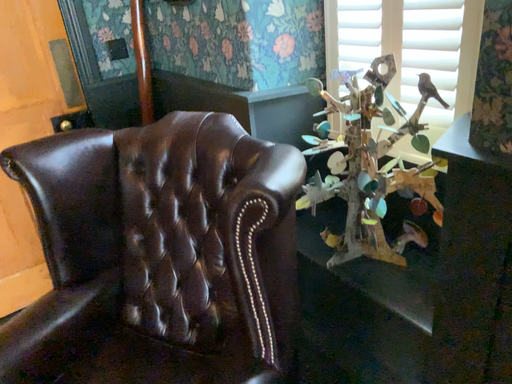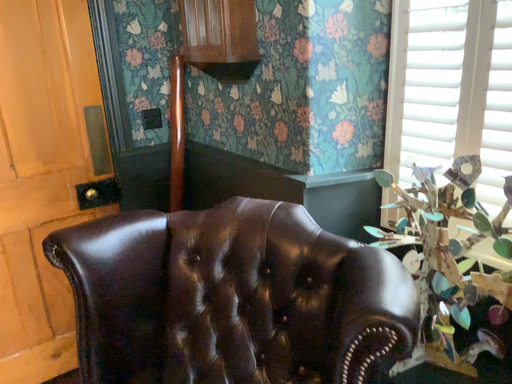
Question: How did the camera likely rotate when shooting the video?

Choices:
 (A) rotated downward
 (B) rotated upward

Answer: (B)